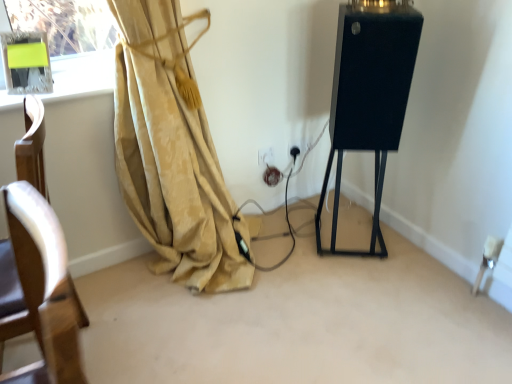
Locate an element on the screen. black fabric speaker at right is located at coordinates (369, 95).

This screenshot has height=384, width=512. What do you see at coordinates (369, 95) in the screenshot? I see `black fabric speaker at right` at bounding box center [369, 95].

Identify the location of white plastic electric outlet at lower center. (266, 156).

The image size is (512, 384). What do you see at coordinates (266, 156) in the screenshot?
I see `white plastic electric outlet at lower center` at bounding box center [266, 156].

This screenshot has height=384, width=512. Find the location of `black fabric speaker at right`. black fabric speaker at right is located at coordinates (369, 95).

Between white plastic electric outlet at lower center and black fabric speaker at right, which one appears on the right side from the viewer's perspective?

black fabric speaker at right.

Between white plastic electric outlet at lower center and black fabric speaker at right, which one is positioned in front?

black fabric speaker at right.

Considering the positions of points (271, 148) and (362, 79), is point (271, 148) farther from camera compared to point (362, 79)?

Yes.

From the image's perspective, between white plastic electric outlet at lower center and black fabric speaker at right, which one is located above?

black fabric speaker at right.

From a real-world perspective, who is located higher, white plastic electric outlet at lower center or black fabric speaker at right?

black fabric speaker at right.

Between white plastic electric outlet at lower center and black fabric speaker at right, which one has smaller width?

white plastic electric outlet at lower center.

Looking at this image, can you confirm if white plastic electric outlet at lower center is taller than black fabric speaker at right?

Incorrect, the height of white plastic electric outlet at lower center is not larger of that of black fabric speaker at right.

Between white plastic electric outlet at lower center and black fabric speaker at right, which one has larger size?

With larger size is black fabric speaker at right.

Is white plastic electric outlet at lower center spatially inside black fabric speaker at right, or outside of it?

white plastic electric outlet at lower center is located beyond the bounds of black fabric speaker at right.

In the scene shown: Is white plastic electric outlet at lower center not close to black fabric speaker at right?

No, white plastic electric outlet at lower center is in close proximity to black fabric speaker at right.

Is white plastic electric outlet at lower center looking in the opposite direction of black fabric speaker at right?

No, white plastic electric outlet at lower center is not facing the opposite direction of black fabric speaker at right.

What are the coordinates of `easel above the white plastic electric outlet at lower center (from a real-world perspective)` in the screenshot? It's located at (369, 95).

Based on their positions, is black fabric speaker at right located to the left or right of white plastic electric outlet at lower center?

Clearly, black fabric speaker at right is on the right of white plastic electric outlet at lower center in the image.

Is black fabric speaker at right behind white plastic electric outlet at lower center?

No, black fabric speaker at right is closer to the viewer.

Considering the positions of points (388, 20) and (263, 164), is point (388, 20) closer to camera compared to point (263, 164)?

Yes, point (388, 20) is in front of point (263, 164).

From the image's perspective, is black fabric speaker at right below white plastic electric outlet at lower center?

No, from the image's perspective, black fabric speaker at right is not beneath white plastic electric outlet at lower center.

From a real-world perspective, which is physically below, black fabric speaker at right or white plastic electric outlet at lower center?

In real-world perspective, white plastic electric outlet at lower center is lower.

Which object is thinner, black fabric speaker at right or white plastic electric outlet at lower center?

Thinner between the two is white plastic electric outlet at lower center.

Considering the sizes of objects black fabric speaker at right and white plastic electric outlet at lower center in the image provided, who is taller, black fabric speaker at right or white plastic electric outlet at lower center?

Standing taller between the two is black fabric speaker at right.

Consider the image. Which of these two, black fabric speaker at right or white plastic electric outlet at lower center, is smaller?

Smaller between the two is white plastic electric outlet at lower center.

Would you say white plastic electric outlet at lower center is part of black fabric speaker at right's contents?

No, black fabric speaker at right does not contain white plastic electric outlet at lower center.

Would you consider black fabric speaker at right to be distant from white plastic electric outlet at lower center?

No, black fabric speaker at right is in close proximity to white plastic electric outlet at lower center.

Is white plastic electric outlet at lower center at the back of black fabric speaker at right?

That's not correct — black fabric speaker at right is not looking away from white plastic electric outlet at lower center.

Can you tell me how much black fabric speaker at right and white plastic electric outlet at lower center differ in facing direction?

The angular difference between black fabric speaker at right and white plastic electric outlet at lower center is 31.7 degrees.

How distant is black fabric speaker at right from white plastic electric outlet at lower center?

The distance of black fabric speaker at right from white plastic electric outlet at lower center is 59.28 centimeters.

In order to click on electric outlet on the left of black fabric speaker at right in this screenshot , I will do `click(266, 156)`.

What are the coordinates of `easel lying on the right of white plastic electric outlet at lower center` in the screenshot? It's located at (369, 95).

The image size is (512, 384). Identify the location of electric outlet that is behind the black fabric speaker at right. (266, 156).